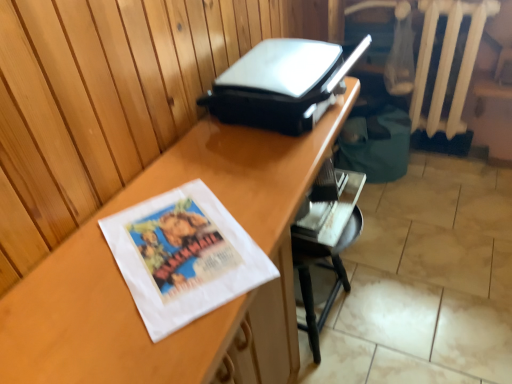
Question: Is white painted wood radiator at upper right wider than metallic silver chair at lower right?

Choices:
 (A) no
 (B) yes

Answer: (A)

Question: Would you say white painted wood radiator at upper right is a long distance from metallic silver chair at lower right?

Choices:
 (A) no
 (B) yes

Answer: (A)

Question: Considering the relative sizes of white painted wood radiator at upper right and metallic silver chair at lower right in the image provided, is white painted wood radiator at upper right thinner than metallic silver chair at lower right?

Choices:
 (A) no
 (B) yes

Answer: (B)

Question: Is white painted wood radiator at upper right oriented towards metallic silver chair at lower right?

Choices:
 (A) no
 (B) yes

Answer: (B)

Question: From a real-world perspective, is white painted wood radiator at upper right located beneath metallic silver chair at lower right?

Choices:
 (A) yes
 (B) no

Answer: (B)

Question: Considering the positions of wooden desk at center and white painted wood radiator at upper right in the image, is wooden desk at center taller or shorter than white painted wood radiator at upper right?

Choices:
 (A) short
 (B) tall

Answer: (B)

Question: Considering their positions, is wooden desk at center located in front of or behind white painted wood radiator at upper right?

Choices:
 (A) front
 (B) behind

Answer: (A)

Question: From a real-world perspective, is wooden desk at center physically located above or below white painted wood radiator at upper right?

Choices:
 (A) below
 (B) above

Answer: (A)

Question: In terms of width, does wooden desk at center look wider or thinner when compared to white painted wood radiator at upper right?

Choices:
 (A) wide
 (B) thin

Answer: (A)

Question: Considering the positions of metallic silver chair at lower right and wooden desk at center in the image, is metallic silver chair at lower right wider or thinner than wooden desk at center?

Choices:
 (A) thin
 (B) wide

Answer: (A)

Question: Considering the positions of point (338, 233) and point (287, 327), is point (338, 233) closer or farther from the camera than point (287, 327)?

Choices:
 (A) closer
 (B) farther

Answer: (B)

Question: Based on their positions, is metallic silver chair at lower right located to the left or right of wooden desk at center?

Choices:
 (A) right
 (B) left

Answer: (A)

Question: Would you say metallic silver chair at lower right is inside or outside wooden desk at center?

Choices:
 (A) inside
 (B) outside

Answer: (A)

Question: Does point (130, 360) appear closer or farther from the camera than point (307, 220)?

Choices:
 (A) farther
 (B) closer

Answer: (B)

Question: From the image's perspective, is wooden desk at center located above or below metallic silver chair at lower right?

Choices:
 (A) below
 (B) above

Answer: (A)